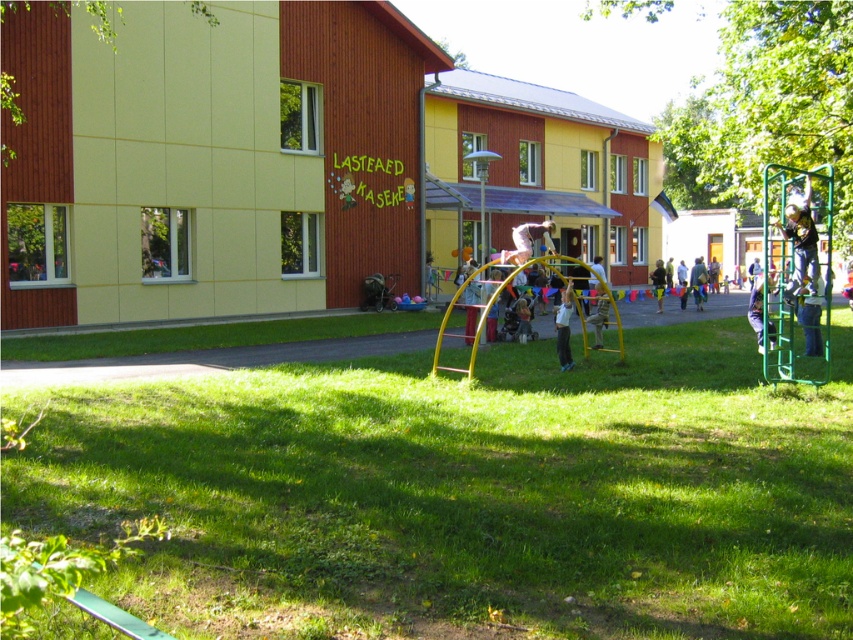
Question: Which object appears closest to the camera in this image?

Choices:
 (A) white fluffy hair at upper right
 (B) light blue fabric pants at center
 (C) light blue jeans at center
 (D) blue fabric pants at center

Answer: (A)

Question: Is green fabric swing at center further to the viewer compared to light blue jeans at center?

Choices:
 (A) no
 (B) yes

Answer: (A)

Question: Does green fabric swing at center have a smaller size compared to light blue jeans at center?

Choices:
 (A) no
 (B) yes

Answer: (B)

Question: Which of the following is the farthest from the observer?

Choices:
 (A) (747, 314)
 (B) (705, 285)
 (C) (567, 292)

Answer: (B)

Question: Can you confirm if blue fabric pants at center is smaller than green fabric swing at center?

Choices:
 (A) no
 (B) yes

Answer: (B)

Question: Which of the following is the farthest from the observer?

Choices:
 (A) blue fabric pants at center
 (B) light blue jeans at center
 (C) white fluffy hair at upper right

Answer: (B)